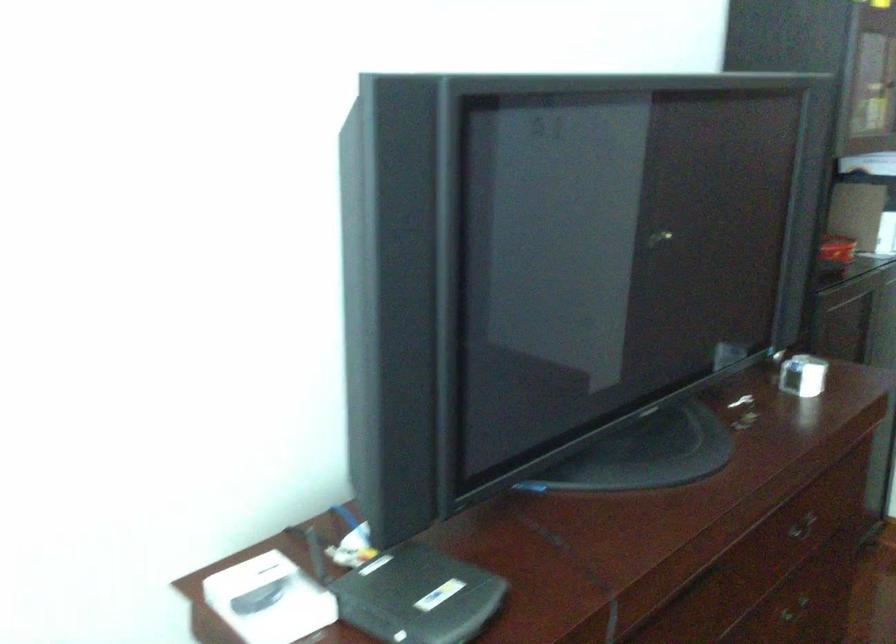
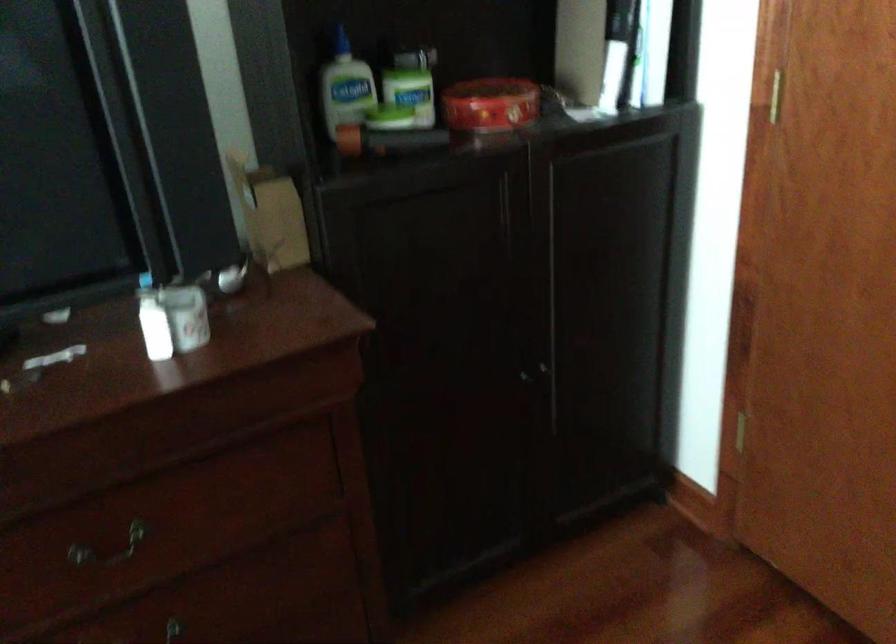
What movement of the cameraman would produce the second image?

The cameraman moved toward right, forward.